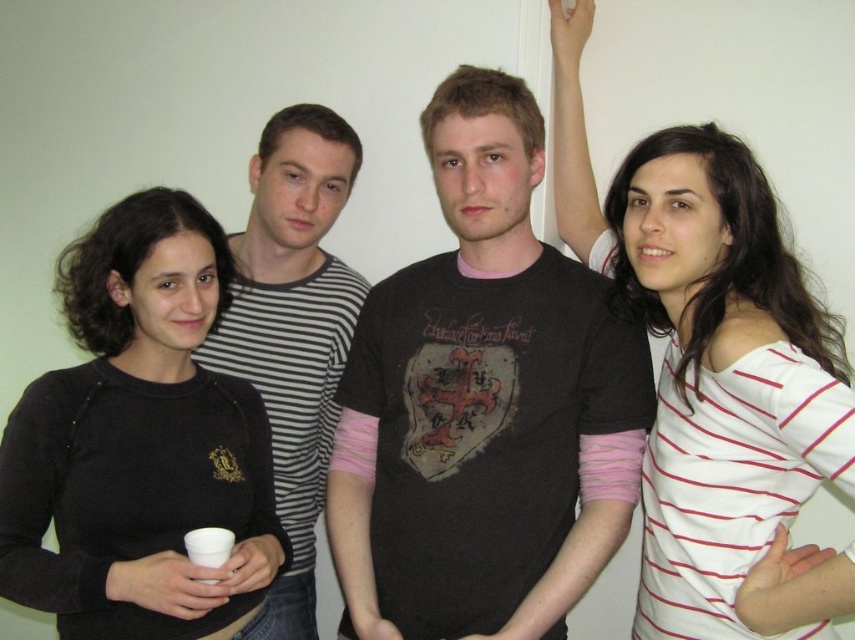
Question: Which point is closer to the camera taking this photo?

Choices:
 (A) (305, 570)
 (B) (463, 86)
 (C) (227, 540)
 (D) (15, 577)

Answer: (D)

Question: Is striped cotton shirt at center positioned behind white styrofoam cup at lower left?

Choices:
 (A) no
 (B) yes

Answer: (B)

Question: Does black matte sweater at left appear under white styrofoam cup at lower left?

Choices:
 (A) no
 (B) yes

Answer: (A)

Question: Based on their relative distances, which object is farther from the white styrofoam cup at lower left?

Choices:
 (A) black matte sweater at left
 (B) black cotton t-shirt at center

Answer: (B)

Question: Considering the relative positions of white striped shirt at center and striped cotton shirt at center in the image provided, where is white striped shirt at center located with respect to striped cotton shirt at center?

Choices:
 (A) right
 (B) left

Answer: (A)

Question: Which is farther from the white striped shirt at center?

Choices:
 (A) black matte sweater at left
 (B) striped cotton shirt at center
 (C) black cotton t-shirt at center

Answer: (A)